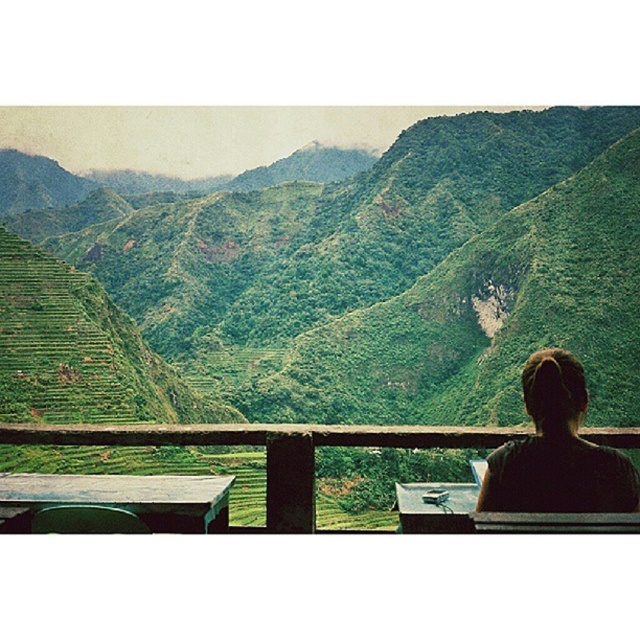
From the picture: Is wooden table at lower left further to camera compared to wooden table at center?

Yes, it is behind wooden table at center.

Can you confirm if wooden table at lower left is positioned above wooden table at center?

Yes.

Image resolution: width=640 pixels, height=640 pixels. What do you see at coordinates (122, 497) in the screenshot?
I see `wooden table at lower left` at bounding box center [122, 497].

At what (x,y) coordinates should I click in order to perform the action: click on wooden table at lower left. Please return your answer as a coordinate pair (x, y). Looking at the image, I should click on (x=122, y=497).

Does dark brown hair at upper right have a lesser width compared to wooden table at lower left?

Correct, dark brown hair at upper right's width is less than wooden table at lower left's.

Which is above, dark brown hair at upper right or wooden table at lower left?

dark brown hair at upper right

The width and height of the screenshot is (640, 640). Identify the location of dark brown hair at upper right. (556, 451).

Does dark brown hair at upper right have a larger size compared to wooden table at center?

Actually, dark brown hair at upper right might be smaller than wooden table at center.

Is point (492, 472) less distant than point (456, 496)?

Yes, point (492, 472) is in front of point (456, 496).

At what (x,y) coordinates should I click in order to perform the action: click on dark brown hair at upper right. Please return your answer as a coordinate pair (x, y). Looking at the image, I should click on (556, 451).